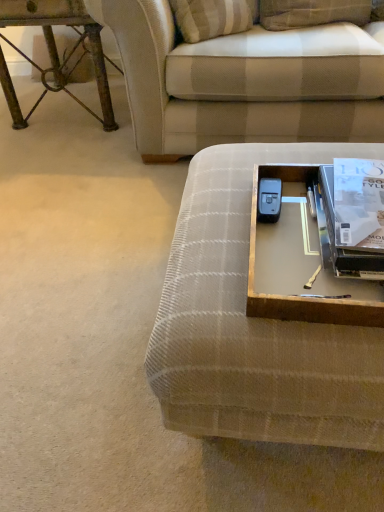
Where is `free spot below metallic silver tray at lower right (from a real-world perspective)`? free spot below metallic silver tray at lower right (from a real-world perspective) is located at coordinates (300, 251).